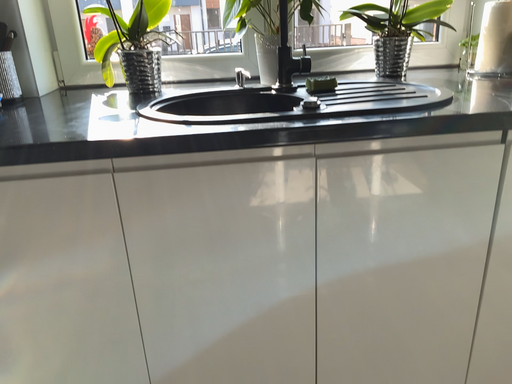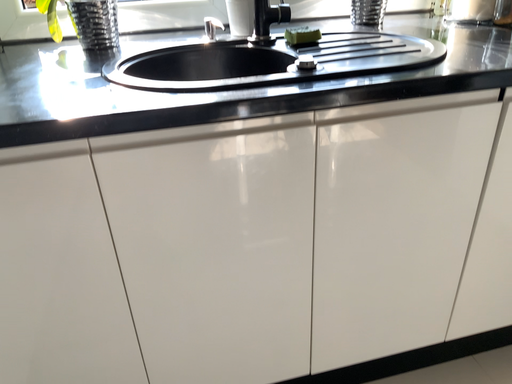
Question: How did the camera likely rotate when shooting the video?

Choices:
 (A) rotated right
 (B) rotated left

Answer: (A)